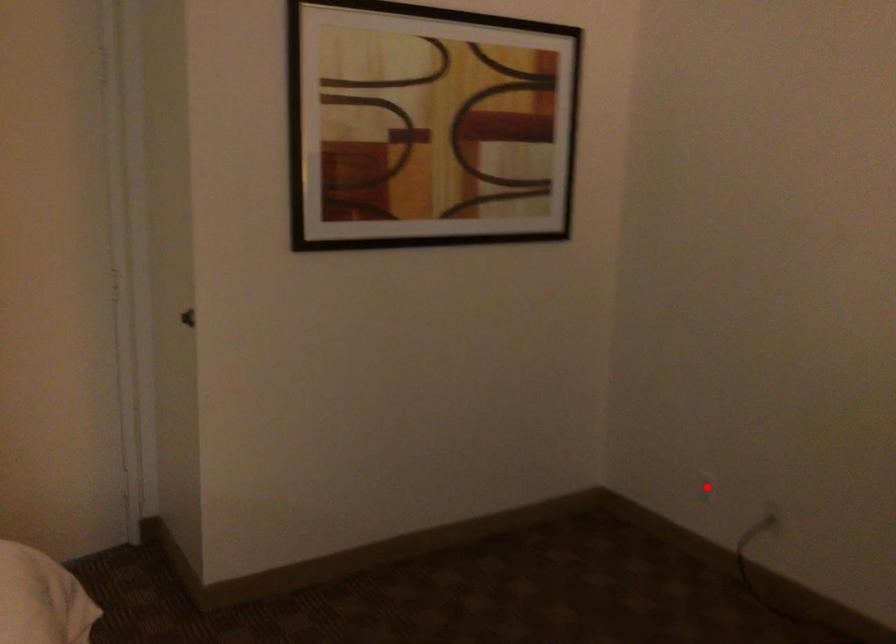
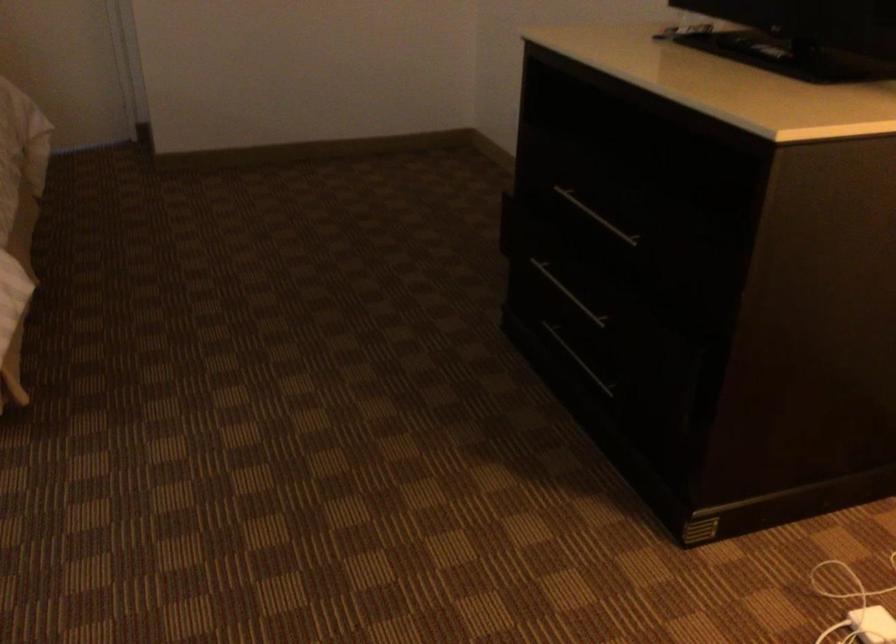
Question: I am providing you with two images of the same scene from different viewpoints. A red point is marked on the first image. At the location where the point appears in image 1, is it still visible in image 2?

Choices:
 (A) Yes
 (B) No

Answer: (B)